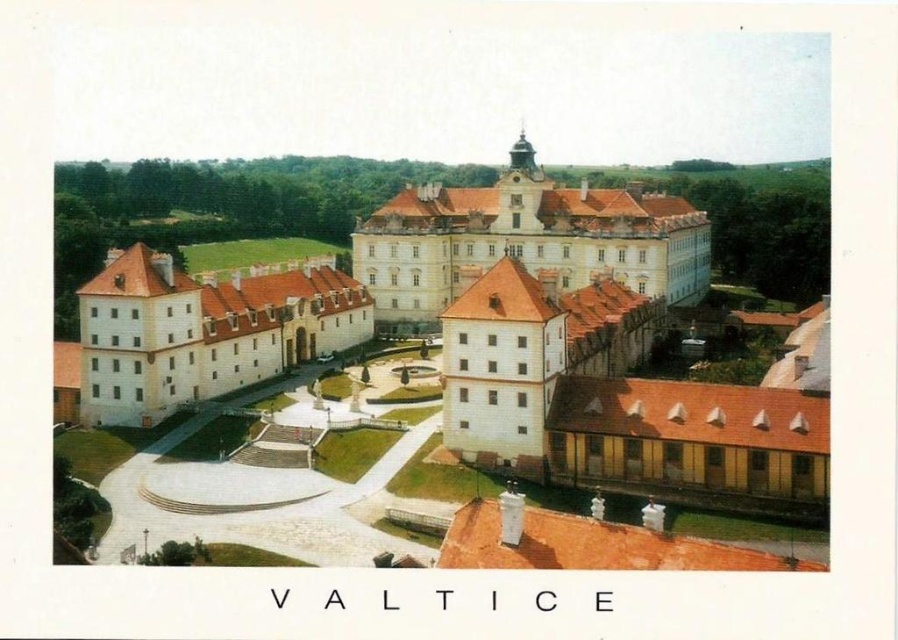
Can you confirm if white stone castle at center is taller than white matte building at left?

Yes, white stone castle at center is taller than white matte building at left.

Can you confirm if white stone castle at center is smaller than white matte building at left?

No, white stone castle at center is not smaller than white matte building at left.

The image size is (898, 640). What do you see at coordinates (526, 240) in the screenshot? I see `white stone castle at center` at bounding box center [526, 240].

This screenshot has height=640, width=898. I want to click on white stone castle at center, so click(x=526, y=240).